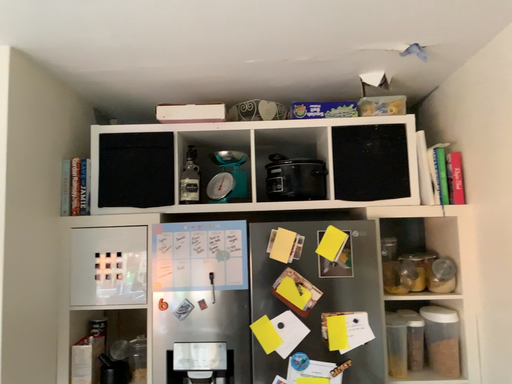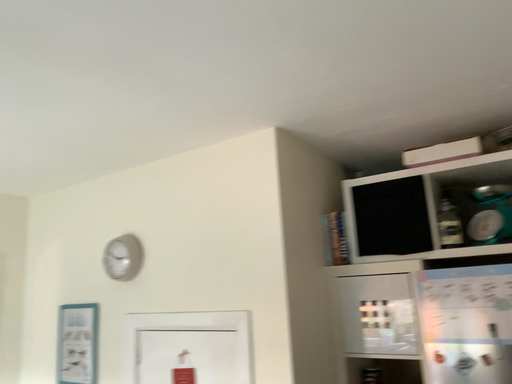
Question: Which way did the camera rotate in the video?

Choices:
 (A) rotated right
 (B) rotated left

Answer: (B)